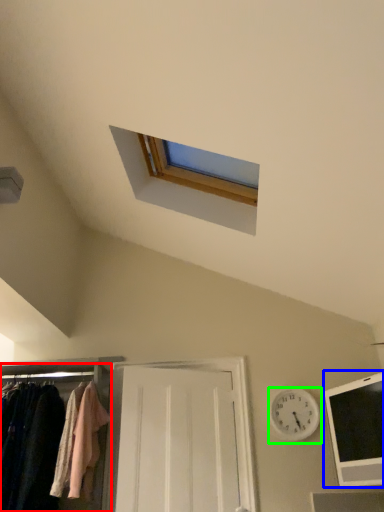
Question: Which is farther away from closet (highlighted by a red box)? hole (highlighted by a blue box) or clock (highlighted by a green box)?

Choices:
 (A) hole
 (B) clock

Answer: (A)